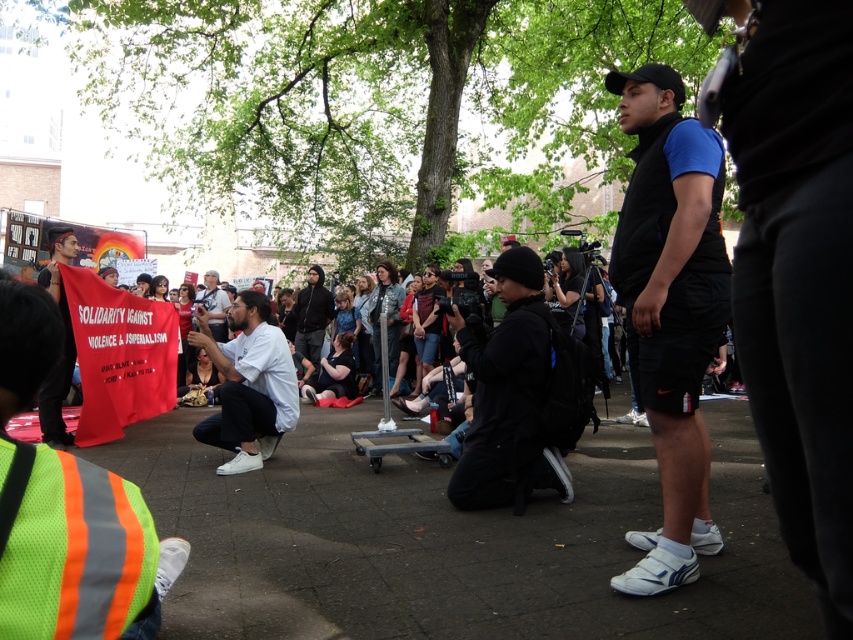
Is point (721, 157) in front of point (480, 472)?

Yes.

Is point (662, 392) positioned behind point (456, 508)?

No, it is not.

What do you see at coordinates (671, 308) in the screenshot?
I see `blue fabric shirt at center` at bounding box center [671, 308].

Where is `blue fabric shirt at center`? This screenshot has width=853, height=640. blue fabric shirt at center is located at coordinates (671, 308).

Is blue fabric shirt at center positioned in front of white shirt at center?

Yes, it is.

Between blue fabric shirt at center and white shirt at center, which one has more height?

With more height is blue fabric shirt at center.

What do you see at coordinates (671, 308) in the screenshot?
I see `blue fabric shirt at center` at bounding box center [671, 308].

The width and height of the screenshot is (853, 640). I want to click on blue fabric shirt at center, so click(x=671, y=308).

Does point (462, 481) come closer to viewer compared to point (251, 406)?

Yes, it is in front of point (251, 406).

Who is lower down, black matte jacket at center or white matte shirt at center?

white matte shirt at center is below.

Describe the element at coordinates (515, 396) in the screenshot. I see `black matte jacket at center` at that location.

This screenshot has height=640, width=853. Find the location of `black matte jacket at center`. black matte jacket at center is located at coordinates (515, 396).